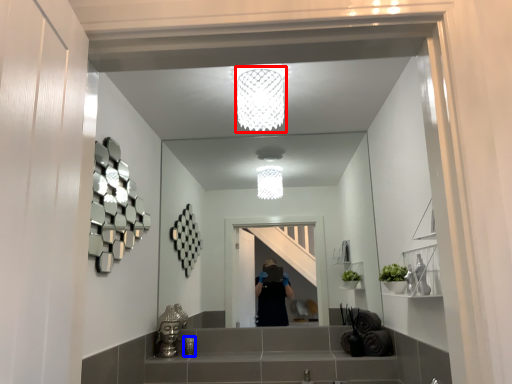
Question: Among these objects, which one is farthest to the camera, light fixture (highlighted by a red box) or toiletry (highlighted by a blue box)?

Choices:
 (A) light fixture
 (B) toiletry

Answer: (B)